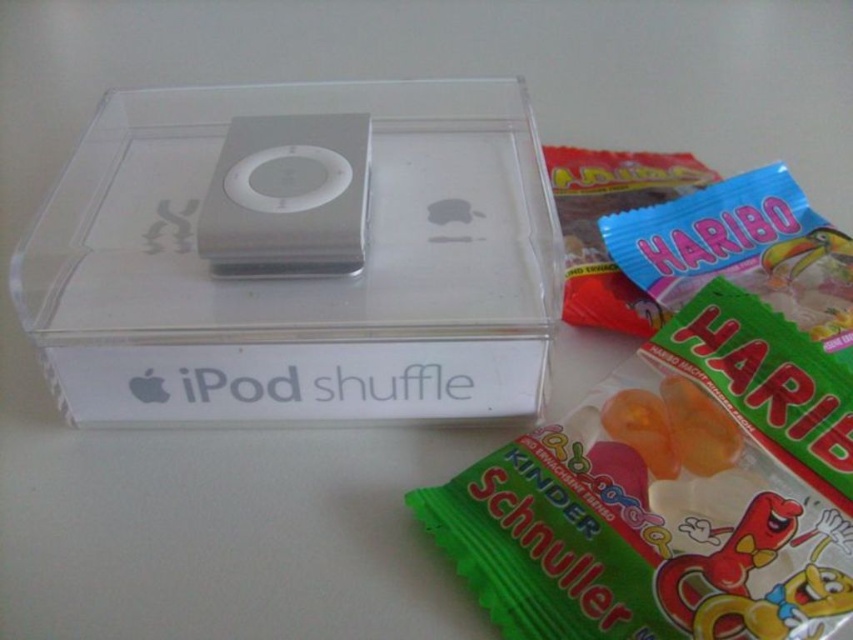
Question: Is clear plastic ipod shuffle at center wider than sleek silver ipod shuffle at center?

Choices:
 (A) yes
 (B) no

Answer: (A)

Question: In this image, where is clear plastic ipod shuffle at center located relative to sleek silver ipod shuffle at center?

Choices:
 (A) above
 (B) below

Answer: (B)

Question: Does clear plastic ipod shuffle at center appear on the right side of sleek silver ipod shuffle at center?

Choices:
 (A) no
 (B) yes

Answer: (B)